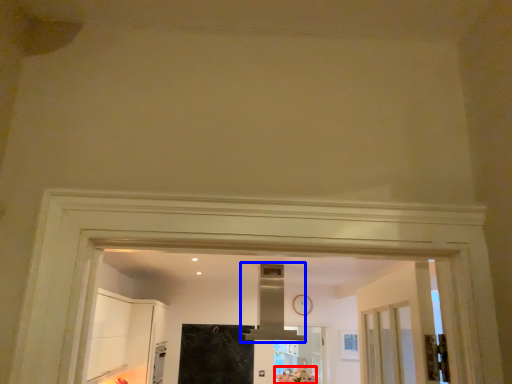
Question: Which object appears farthest to the camera in this image, flower (highlighted by a red box) or exhaust hood (highlighted by a blue box)?

Choices:
 (A) flower
 (B) exhaust hood

Answer: (A)